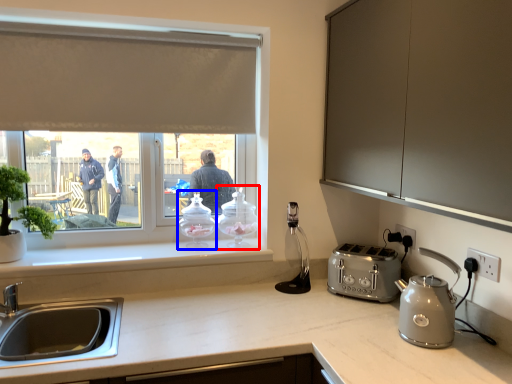
Question: Among these objects, which one is farthest to the camera, kitchen appliance (highlighted by a red box) or kitchen appliance (highlighted by a blue box)?

Choices:
 (A) kitchen appliance
 (B) kitchen appliance

Answer: (A)